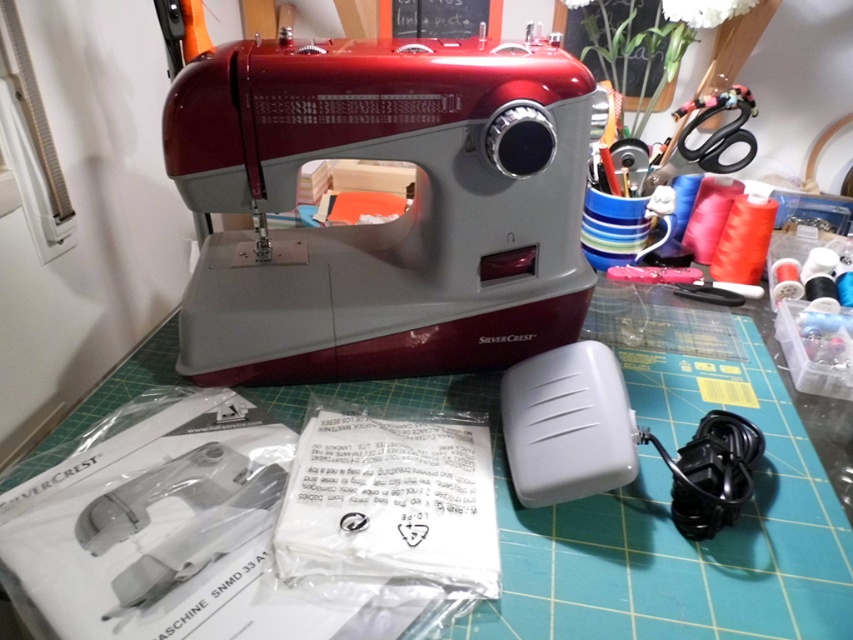
You are a tailor who needs to place a small button on the highest point of the matte red sewing machine at center and the metallic silver scissors at upper right. Which object should you choose?

The matte red sewing machine at center is much taller than the metallic silver scissors at upper right, so you should place the button on the matte red sewing machine at center.

You are looking at the sewing machine setup. There are two points marked in the image. The first point is at coordinate point (415, 305) and the second point is at coordinate point (695, 154). Which of these two points is nearer to you?

Point (415, 305) is closer to the viewer than point (695, 154).